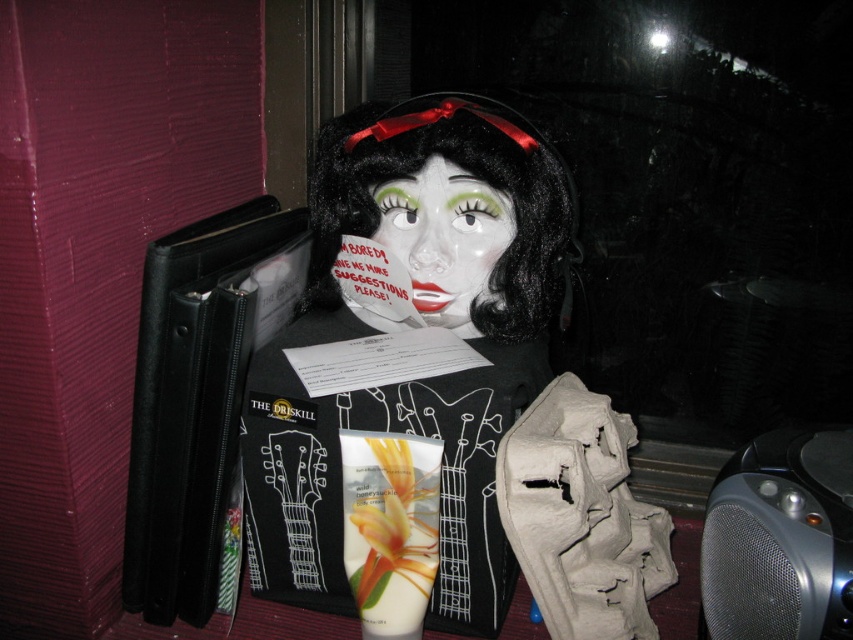
Consider the image. You are a stagehand setting up a performance area. You need to place a black velvet wig at center and a silver mesh speaker at lower right. The stage has a 12 inch width limit between the two items. Can you fit them within this constraint?

The distance between the black velvet wig at center and the silver mesh speaker at lower right is 13.41 inches, which exceeds the 12 inch width limit. Therefore, they cannot be placed within the required constraint.

You are an interior designer planning to place a decorative item in a room with a dark background. You have the matte black doll at center and the porcelain face at center. Which object should you choose if you want the item to stand out more due to its size?

The matte black doll at center has a larger size compared to porcelain face at center, so it would stand out more in the dark background.

You are standing in front of the mannequin holding the paper. You want to place a small sticker on the point that is closer to you. Which point should you choose between point (451,244) and point (390,220)?

You should choose point (451,244) because it is closer to the viewer than point (390,220).